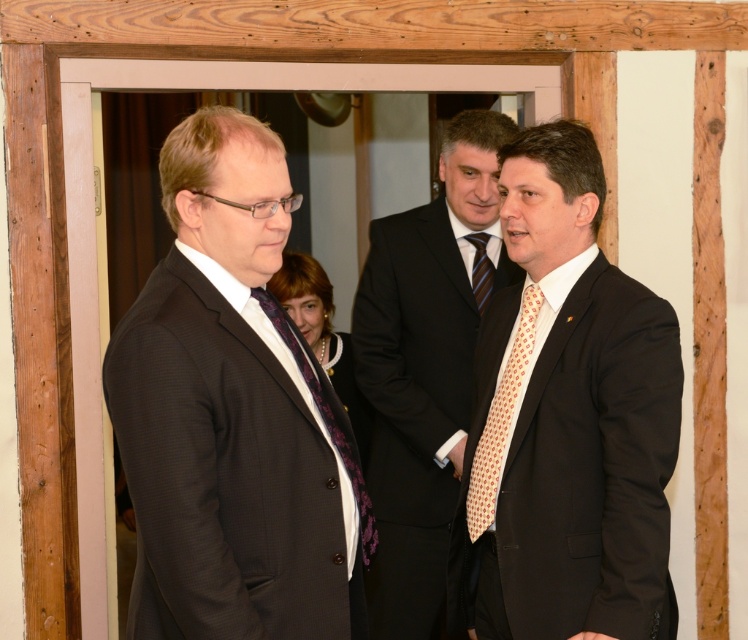
Is point (236, 387) positioned after point (328, 429)?

No, it is in front of (328, 429).

Is matte black suit at left to the left of purple textured tie at center from the viewer's perspective?

Correct, you'll find matte black suit at left to the left of purple textured tie at center.

Identify the location of matte black suit at left. Image resolution: width=748 pixels, height=640 pixels. (232, 413).

At what (x,y) coordinates should I click in order to perform the action: click on matte black suit at left. Please return your answer as a coordinate pair (x, y). This screenshot has width=748, height=640. Looking at the image, I should click on (232, 413).

Does matte black suit at center have a larger size compared to purple textured tie at center?

Indeed, matte black suit at center has a larger size compared to purple textured tie at center.

Can you confirm if matte black suit at center is wider than purple textured tie at center?

Correct, the width of matte black suit at center exceeds that of purple textured tie at center.

What do you see at coordinates (423, 369) in the screenshot?
I see `matte black suit at center` at bounding box center [423, 369].

I want to click on matte black suit at center, so click(x=423, y=369).

Between light orange dotted tie at right and purple textured tie at center, which one appears on the left side from the viewer's perspective?

purple textured tie at center is more to the left.

Who is more forward, [476,474] or [361,540]?

Point [361,540] is more forward.

Where is `light orange dotted tie at right`? light orange dotted tie at right is located at coordinates (500, 419).